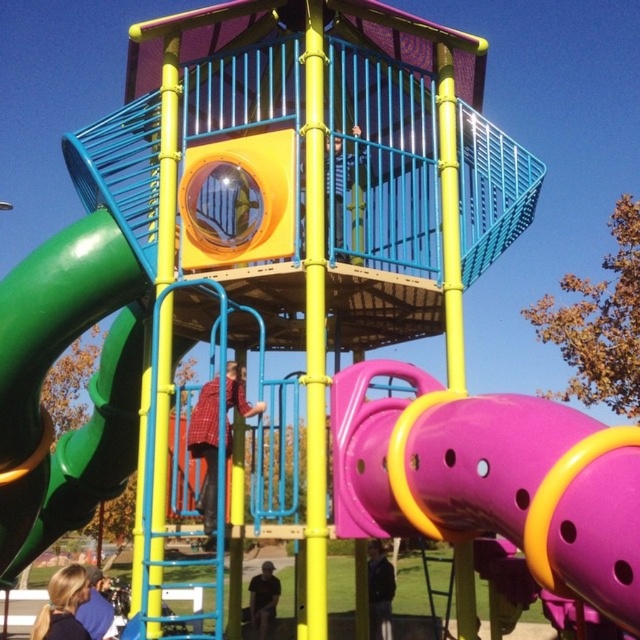
You are a parent watching your children play at the playground. You see the red plaid shirt at center and the dark gray shirt at lower center. Which child is closer to you?

The red plaid shirt at center is closer to you because it is in front of the dark gray shirt at lower center.

You are standing at the entrance of the playground and see the red plaid shirt at center. Based on the coordinates provided, can you determine if the shirt is positioned closer to the top or bottom of the image?

The red plaid shirt at center is located at point [205,452]. Since the y coordinate is 0.323, which is closer to 0.5 than 0, the shirt is positioned closer to the bottom of the image.